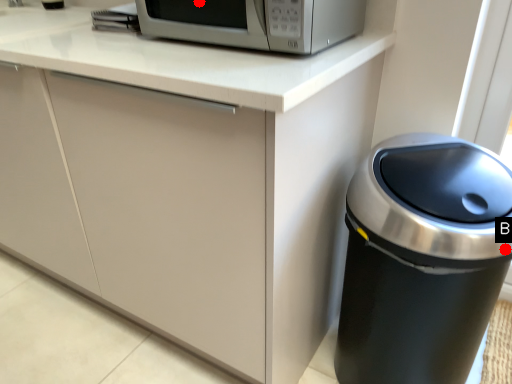
Question: Two points are circled on the image, labeled by A and B beside each circle. Which point is closer to the camera?

Choices:
 (A) A is closer
 (B) B is closer

Answer: (B)